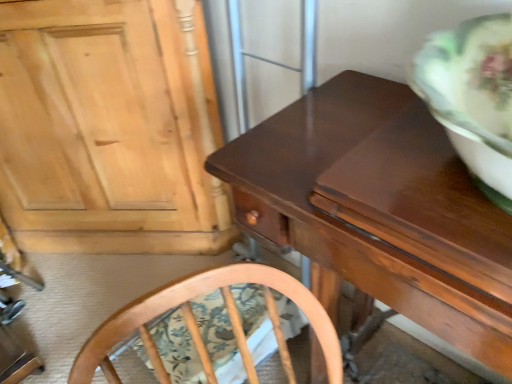
Describe the element at coordinates (108, 129) in the screenshot. Image resolution: width=512 pixels, height=384 pixels. I see `light wood cabinet at upper left` at that location.

Locate an element on the screen. light wood cabinet at upper left is located at coordinates (108, 129).

Describe the element at coordinates (384, 209) in the screenshot. I see `shiny brown wood table at center` at that location.

At what (x,y) coordinates should I click in order to perform the action: click on shiny brown wood table at center. Please return your answer as a coordinate pair (x, y). This screenshot has height=384, width=512. Looking at the image, I should click on (384, 209).

Measure the distance between shiny brown wood table at center and camera.

shiny brown wood table at center and camera are 16.36 inches apart from each other.

At what (x,y) coordinates should I click in order to perform the action: click on light wood cabinet at upper left. Please return your answer as a coordinate pair (x, y). Image resolution: width=512 pixels, height=384 pixels. Looking at the image, I should click on (108, 129).

Which object is positioned more to the left, shiny brown wood table at center or light wood cabinet at upper left?

From the viewer's perspective, light wood cabinet at upper left appears more on the left side.

In the scene shown: Is shiny brown wood table at center in front of or behind light wood cabinet at upper left in the image?

shiny brown wood table at center is positioned closer to the viewer than light wood cabinet at upper left.

Is point (374, 89) less distant than point (32, 111)?

Yes, it is.

From the image's perspective, would you say shiny brown wood table at center is positioned over light wood cabinet at upper left?

Incorrect, from the image's perspective, shiny brown wood table at center is lower than light wood cabinet at upper left.

From a real-world perspective, is shiny brown wood table at center on light wood cabinet at upper left?

Correct, in the physical world, shiny brown wood table at center is higher than light wood cabinet at upper left.

Considering the relative sizes of shiny brown wood table at center and light wood cabinet at upper left in the image provided, is shiny brown wood table at center wider than light wood cabinet at upper left?

Yes, shiny brown wood table at center is wider than light wood cabinet at upper left.

From their relative heights in the image, would you say shiny brown wood table at center is taller or shorter than light wood cabinet at upper left?

Clearly, shiny brown wood table at center is shorter compared to light wood cabinet at upper left.

Looking at the image, does shiny brown wood table at center seem bigger or smaller compared to light wood cabinet at upper left?

Clearly, shiny brown wood table at center is smaller in size than light wood cabinet at upper left.

Can we say shiny brown wood table at center lies outside light wood cabinet at upper left?

That's correct, shiny brown wood table at center is outside of light wood cabinet at upper left.

Is shiny brown wood table at center far from light wood cabinet at upper left?

No, shiny brown wood table at center is not far from light wood cabinet at upper left.

In the scene shown: Is shiny brown wood table at center positioned with its back to light wood cabinet at upper left?

No.

How different are the orientations of shiny brown wood table at center and light wood cabinet at upper left in degrees?

38.1 degrees.

Looking at this image, how distant is shiny brown wood table at center from light wood cabinet at upper left?

shiny brown wood table at center is 69.23 centimeters from light wood cabinet at upper left.

At what (x,y) coordinates should I click in order to perform the action: click on table that is in front of the light wood cabinet at upper left. Please return your answer as a coordinate pair (x, y). Looking at the image, I should click on (384, 209).

Based on their positions, is light wood cabinet at upper left located to the left or right of shiny brown wood table at center?

light wood cabinet at upper left is positioned on shiny brown wood table at center's left side.

Does light wood cabinet at upper left lie behind shiny brown wood table at center?

Yes.

Considering the positions of point (9, 14) and point (473, 232), is point (9, 14) closer or farther from the camera than point (473, 232)?

Point (9, 14).

From the image's perspective, which one is positioned lower, light wood cabinet at upper left or shiny brown wood table at center?

shiny brown wood table at center, from the image's perspective.

From a real-world perspective, which object rests below the other?

light wood cabinet at upper left, from a real-world perspective.

Does light wood cabinet at upper left have a lesser width compared to shiny brown wood table at center?

Indeed, light wood cabinet at upper left has a lesser width compared to shiny brown wood table at center.

Between light wood cabinet at upper left and shiny brown wood table at center, which one has less height?

shiny brown wood table at center is shorter.

Considering the relative sizes of light wood cabinet at upper left and shiny brown wood table at center in the image provided, is light wood cabinet at upper left smaller than shiny brown wood table at center?

Actually, light wood cabinet at upper left might be larger than shiny brown wood table at center.

Is shiny brown wood table at center inside light wood cabinet at upper left?

Actually, shiny brown wood table at center is outside light wood cabinet at upper left.

Would you say light wood cabinet at upper left is a long distance from shiny brown wood table at center?

No.

Consider the image. Could you tell me if light wood cabinet at upper left is turned towards shiny brown wood table at center?

No, light wood cabinet at upper left does not turn towards shiny brown wood table at center.

Can you tell me how much light wood cabinet at upper left and shiny brown wood table at center differ in facing direction?

light wood cabinet at upper left and shiny brown wood table at center are facing 38.1 degrees away from each other.

You are a GUI agent. You are given a task and a screenshot of the screen. Output one action in this format:
    pyautogui.click(x=<x>, y=<y>)
    Task: Click on the table on the right of the light wood cabinet at upper left
    
    Given the screenshot: What is the action you would take?
    pyautogui.click(x=384, y=209)

Find the location of a particular element. This screenshot has width=512, height=384. cabinetry that is on the left side of shiny brown wood table at center is located at coordinates 108,129.

Identify the location of table that appears above the light wood cabinet at upper left (from a real-world perspective). The height and width of the screenshot is (384, 512). (384, 209).